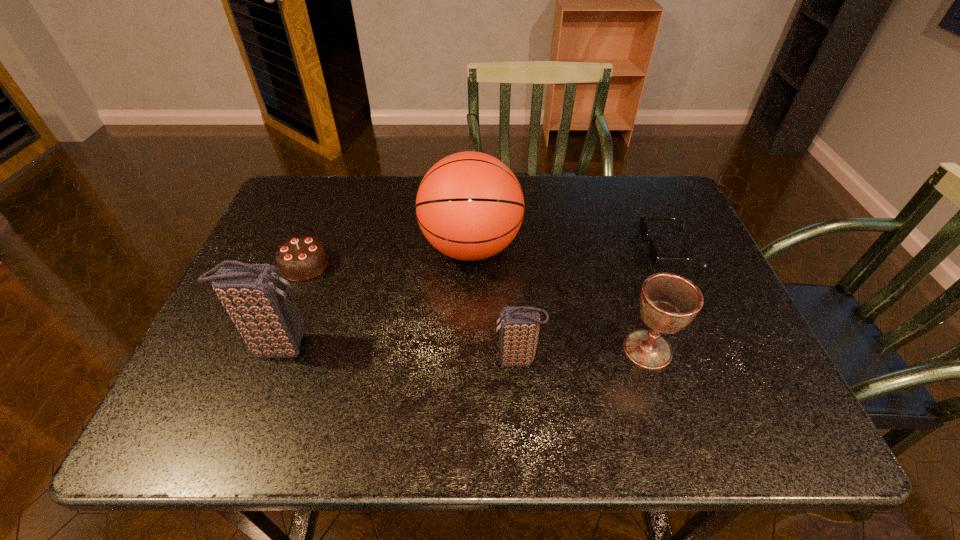
All clutch bags are currently evenly spaced. To continue this pattern, where would you add another clutch bag on the right? Please point out a vacant spot. Please provide its 2D coordinates. Your answer should be formatted as a tuple, i.e. [(x, y)], where the tuple contains the x and y coordinates of a point satisfying the conditions above.

[(771, 374)]